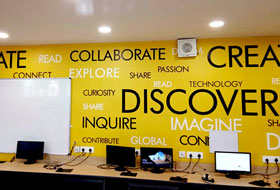
You are a GUI agent. You are given a task and a screenshot of the screen. Output one action in this format:
    pyautogui.click(x=<x>, y=<y>)
    Task: Click on the tablet screen on
    
    Given the screenshot: What is the action you would take?
    pyautogui.click(x=237, y=160)